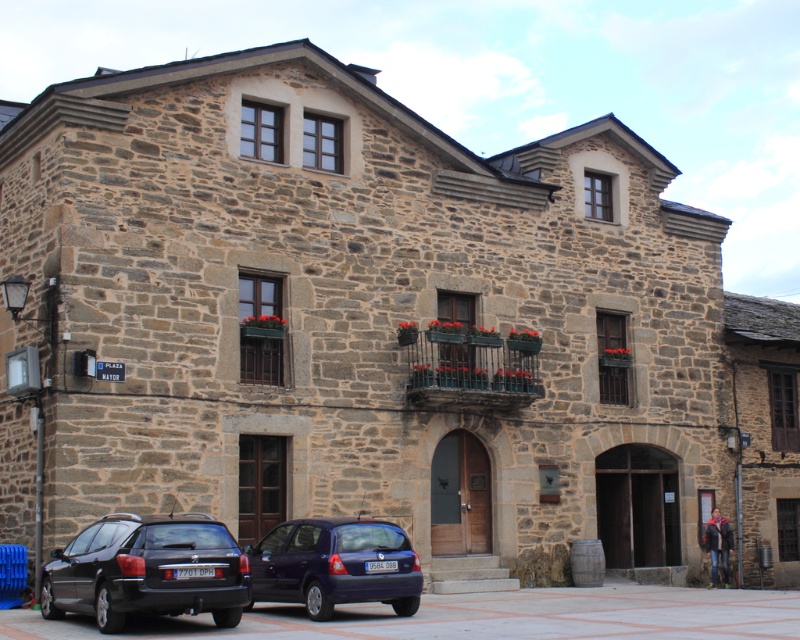
Question: Is shiny black station wagon at lower left behind metallic blue hatchback at center?

Choices:
 (A) yes
 (B) no

Answer: (B)

Question: Which of the following is the farthest from the observer?

Choices:
 (A) (330, 556)
 (B) (210, 570)

Answer: (A)

Question: Is the position of shiny black station wagon at lower left less distant than that of metallic blue hatchback at center?

Choices:
 (A) yes
 (B) no

Answer: (A)

Question: Is shiny black station wagon at lower left bigger than metallic blue hatchback at center?

Choices:
 (A) no
 (B) yes

Answer: (A)

Question: Which point is closer to the camera?

Choices:
 (A) metallic blue hatchback at center
 (B) shiny black station wagon at lower left

Answer: (B)

Question: Among these points, which one is nearest to the camera?

Choices:
 (A) coord(216,520)
 (B) coord(364,544)

Answer: (B)